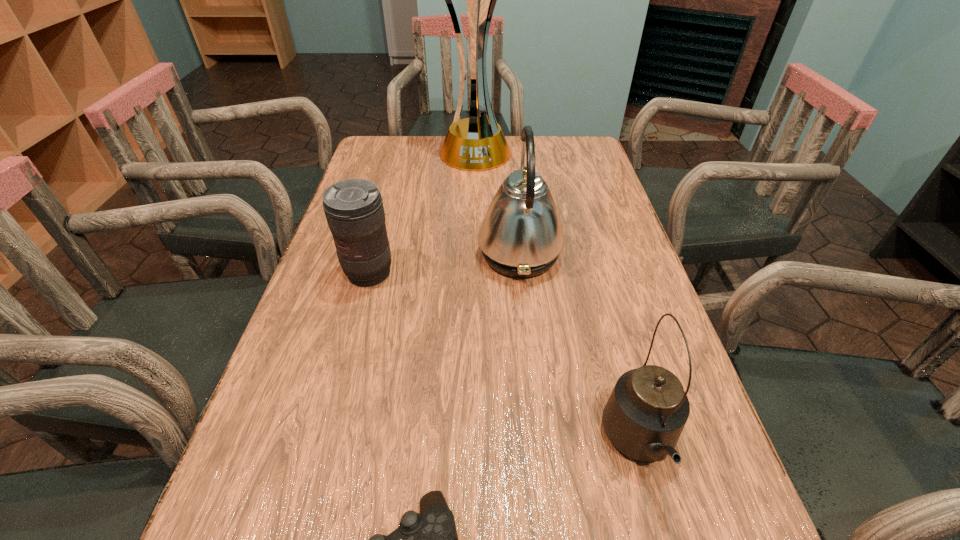
At what (x,y) coordinates should I click in order to perform the action: click on vacant area between the trophy and the shorter kettle. Please return your answer as a coordinate pair (x, y). Looking at the image, I should click on (557, 299).

Identify the location of empty space that is in between the tallest object and the fourth tallest object. This screenshot has width=960, height=540. (421, 213).

Image resolution: width=960 pixels, height=540 pixels. Find the location of `free space between the rightmost object and the trophy`. free space between the rightmost object and the trophy is located at coordinates (557, 299).

This screenshot has height=540, width=960. What are the coordinates of `vacant area that lies between the farthest object and the leftmost object` in the screenshot? It's located at (421, 213).

Where is `object that is the third closest to the shorter kettle`? Image resolution: width=960 pixels, height=540 pixels. object that is the third closest to the shorter kettle is located at coordinates (354, 210).

Identify the location of object that is the closest to the trophy. (521, 235).